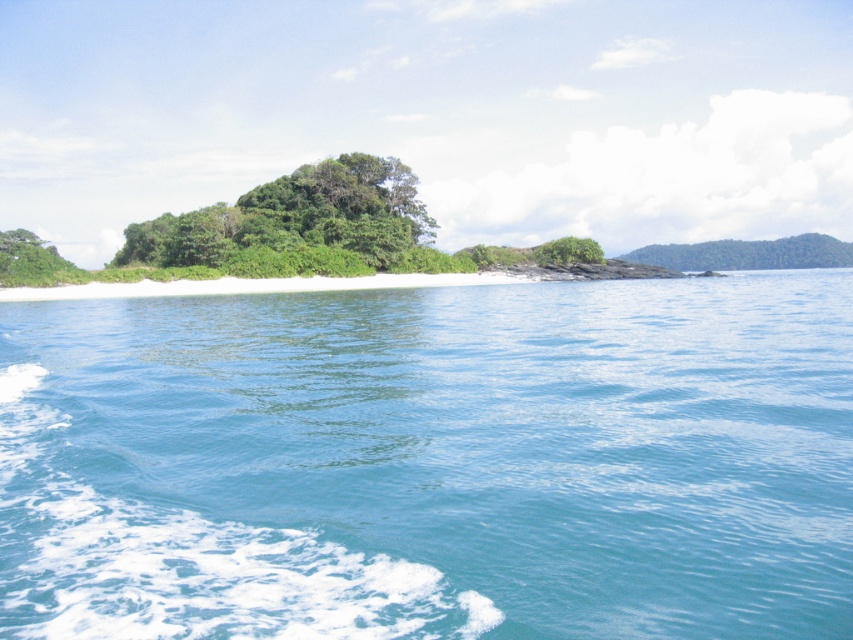
Is clear blue water at center smaller than green leafy bush at center?

No, clear blue water at center is not smaller than green leafy bush at center.

Which is below, clear blue water at center or green leafy bush at center?

clear blue water at center

Is point (15, 548) in front of point (587, 259)?

That is True.

Where is `clear blue water at center`? The image size is (853, 640). clear blue water at center is located at coordinates (432, 461).